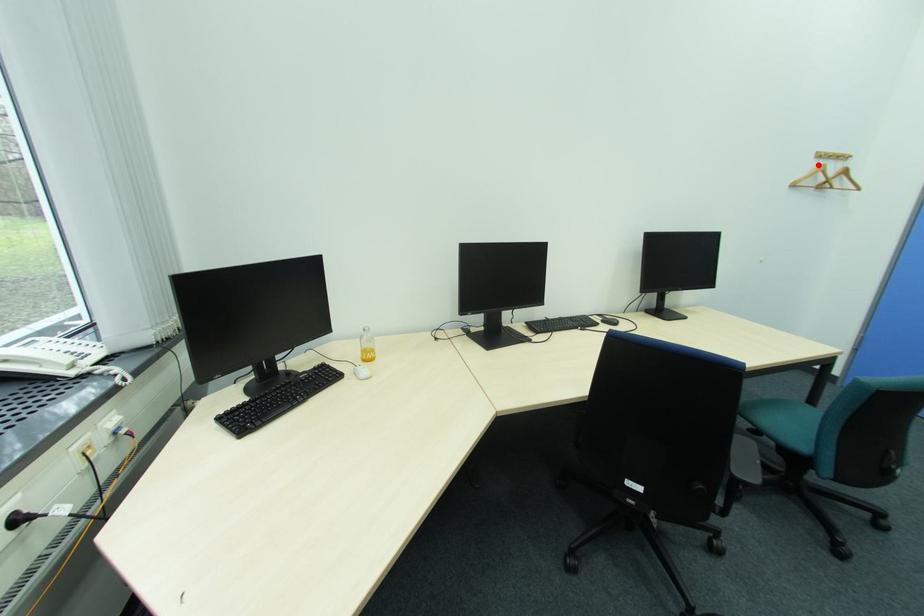
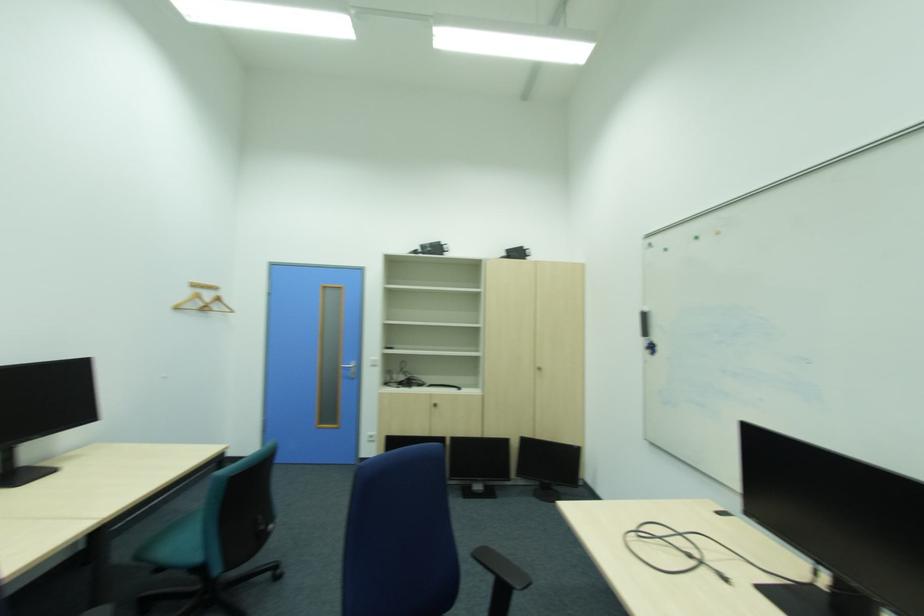
In the second image, find the point that corresponds to the highlighted location in the first image.

(199, 292)